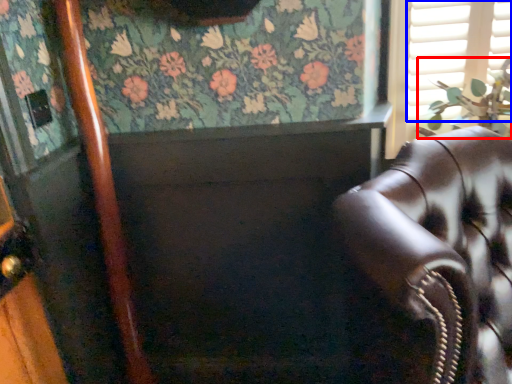
Question: Which object appears farthest to the camera in this image, plant (highlighted by a red box) or shutter (highlighted by a blue box)?

Choices:
 (A) plant
 (B) shutter

Answer: (B)